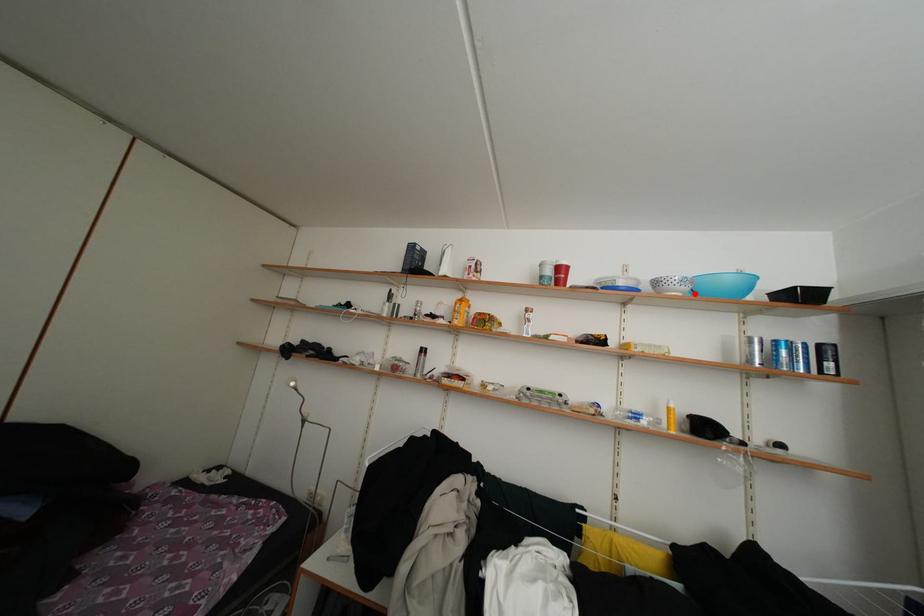
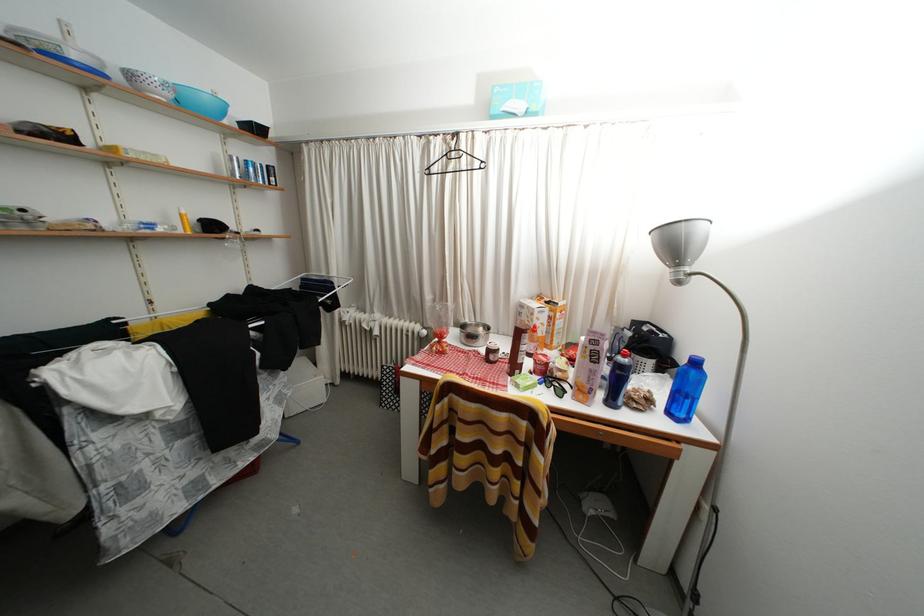
Locate, in the second image, the point that corresponds to the highlighted location in the first image.

(178, 100)